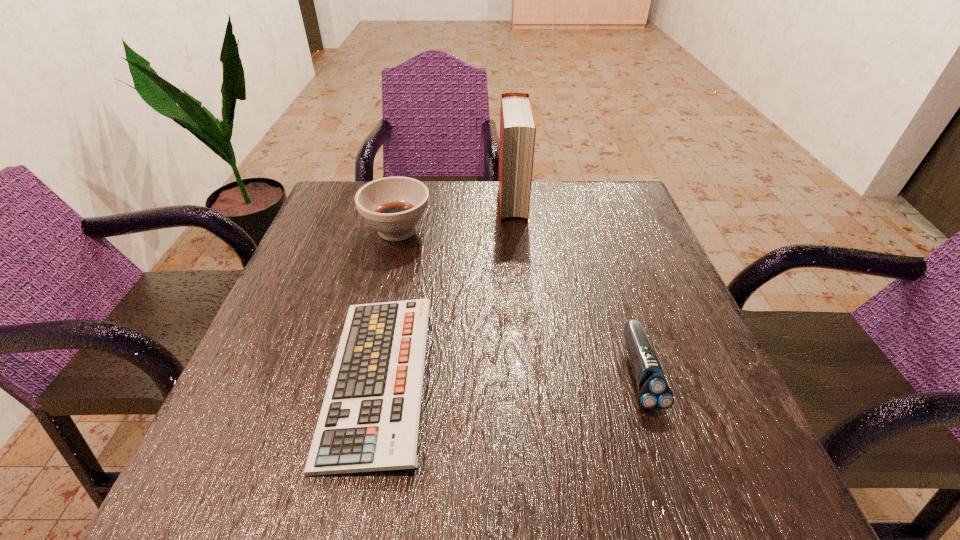
Identify the location of the tallest object. (517, 121).

The height and width of the screenshot is (540, 960). Identify the location of hardback book. (517, 121).

In order to click on the second tallest object in this screenshot , I will do `click(394, 206)`.

This screenshot has width=960, height=540. I want to click on the rightmost object, so click(x=654, y=394).

Image resolution: width=960 pixels, height=540 pixels. What are the coordinates of `electric shaver` in the screenshot? It's located at tap(654, 394).

At what (x,y) coordinates should I click in order to perform the action: click on the shortest object. Please return your answer as a coordinate pair (x, y). This screenshot has height=540, width=960. Looking at the image, I should click on (369, 421).

Locate an element on the screen. This screenshot has width=960, height=540. blank space located 0.080m on the open cover of the hardback book is located at coordinates (516, 243).

This screenshot has width=960, height=540. What are the coordinates of `free region located on the front of the soup bowl` in the screenshot? It's located at (374, 329).

You are a GUI agent. You are given a task and a screenshot of the screen. Output one action in this format:
    pyautogui.click(x=<x>, y=<y>)
    Task: Click on the vacant space located on the head of the electric shaver
    The image size is (960, 540).
    Given the screenshot: What is the action you would take?
    pyautogui.click(x=680, y=496)

Identify the location of vacant point located 0.390m on the back of the computer keyboard. (415, 200).